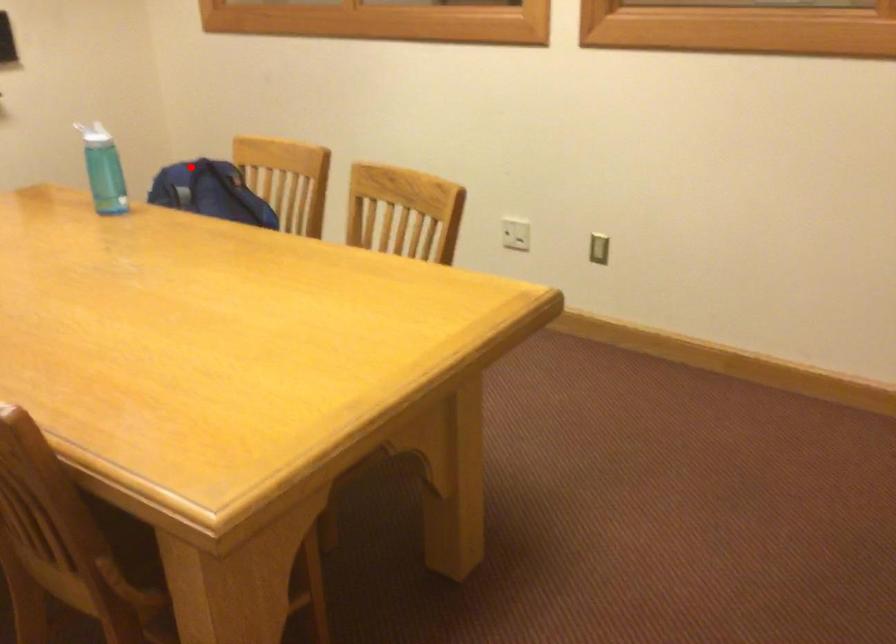
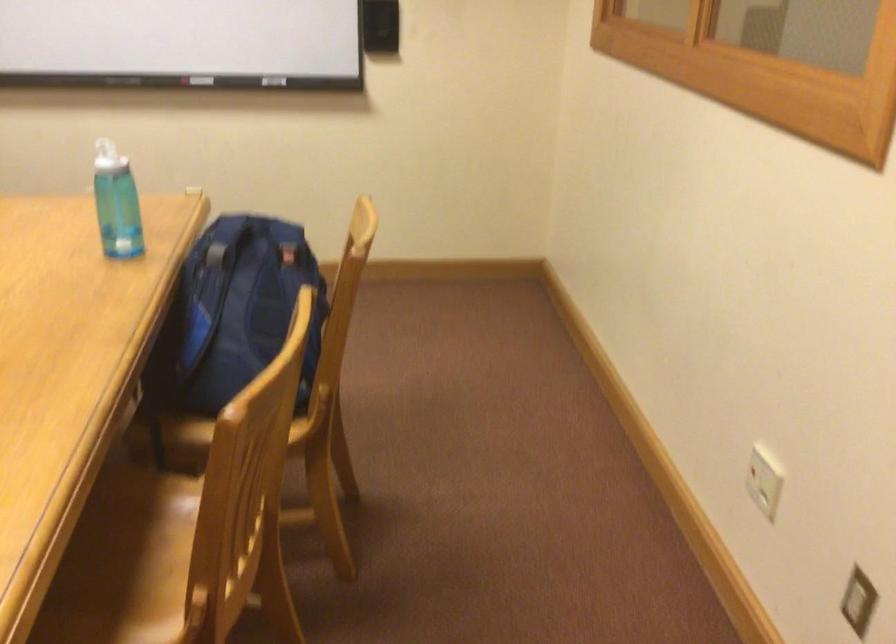
Question: A red point is marked in image1. In image2, is the corresponding 3D point closer to the camera or farther? Reply with the corresponding letter.

Choices:
 (A) The corresponding 3D point is closer.
 (B) The corresponding 3D point is farther.

Answer: (A)